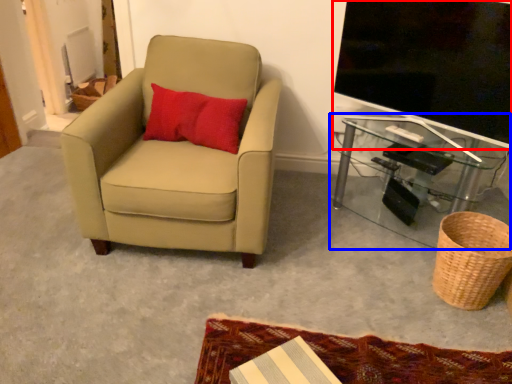
Question: Which of the following is the closest to the observer, television (highlighted by a red box) or table (highlighted by a blue box)?

Choices:
 (A) television
 (B) table

Answer: (A)